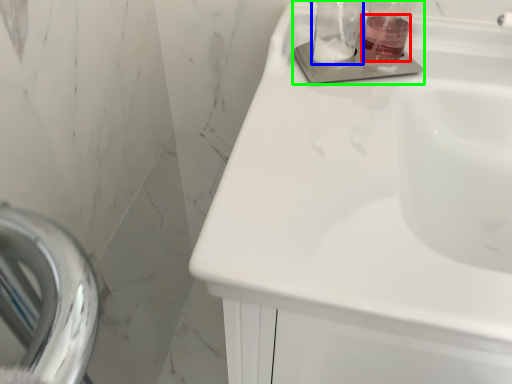
Question: Which object is the farthest from liquid (highlighted by a red box)? Choose among these: glass jar (highlighted by a blue box) or sink (highlighted by a green box).

Choices:
 (A) glass jar
 (B) sink

Answer: (A)